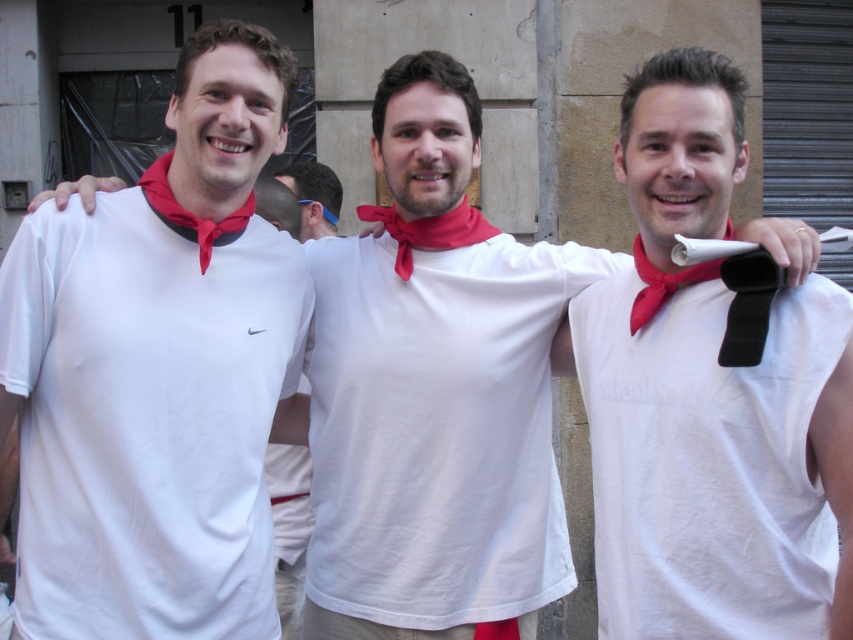
Is white matte shirt at left positioned before matte red scarf at center?

No, it is behind matte red scarf at center.

Does white matte shirt at left have a greater height compared to matte red scarf at center?

Yes.

Who is more forward, (128, 308) or (692, 259)?

Positioned in front is point (692, 259).

Locate an element on the screen. white matte shirt at left is located at coordinates (146, 412).

Between white matte shirt at left and red satin necktie at center, which one appears on the left side from the viewer's perspective?

white matte shirt at left is more to the left.

Is white matte shirt at left above red satin necktie at center?

No.

Does point (33, 504) come behind point (200, 150)?

No, it is not.

Locate an element on the screen. This screenshot has height=640, width=853. white matte shirt at left is located at coordinates (146, 412).

Identify the location of red satin bow tie at left. (189, 211).

Does red satin bow tie at left have a lesser height compared to blue plastic ear at center?

Yes.

Which is behind, point (202, 227) or point (305, 179)?

Positioned behind is point (305, 179).

Find the location of a particular element. Image resolution: width=853 pixels, height=640 pixels. red satin bow tie at left is located at coordinates (189, 211).